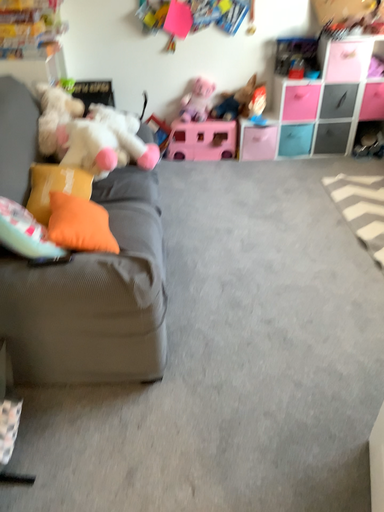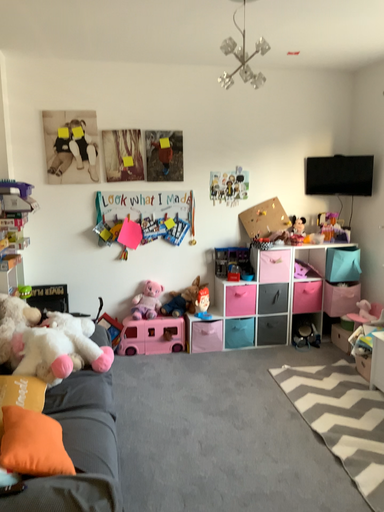
Question: Which way did the camera rotate in the video?

Choices:
 (A) rotated left
 (B) rotated right

Answer: (B)